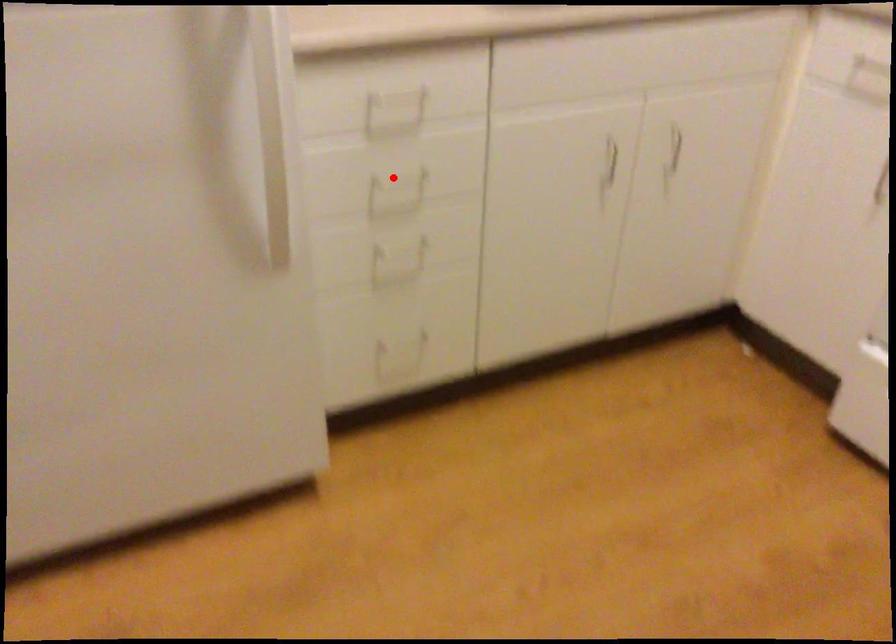
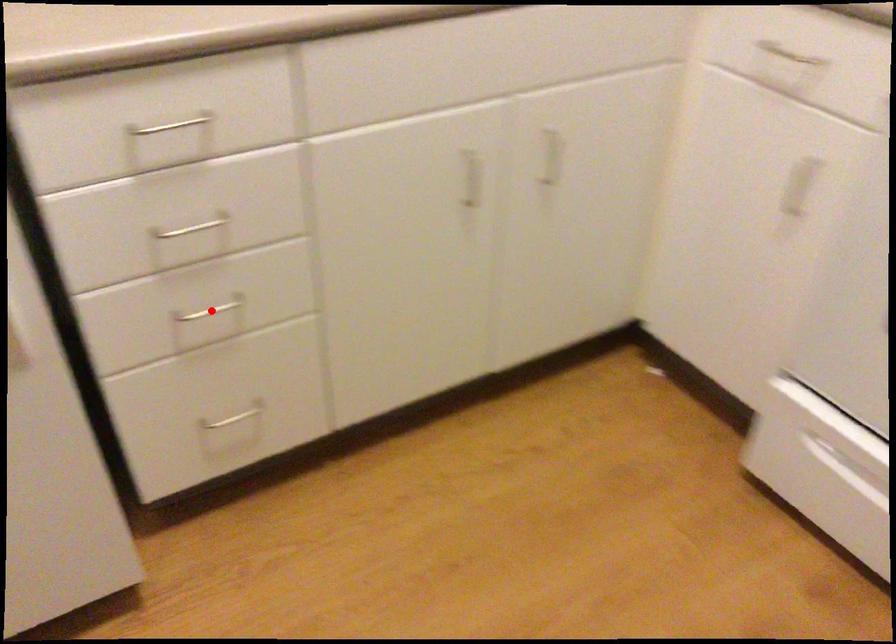
I am providing you with two images of the same scene from different viewpoints. A red point is marked on the first image and another point is marked on the second image. Is the red point in image1 aligned with the point shown in image2?

No